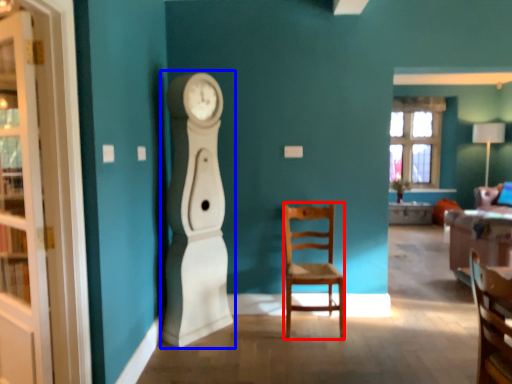
Question: Which object is closer to the camera taking this photo, chair (highlighted by a red box) or clock (highlighted by a blue box)?

Choices:
 (A) chair
 (B) clock

Answer: (B)